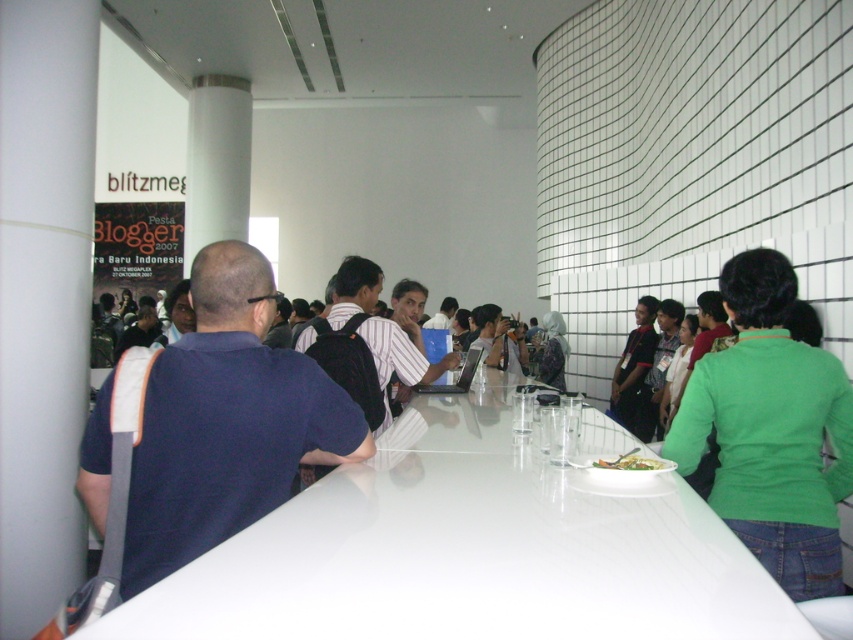
Question: Does dark blue shirt at left have a smaller size compared to green leafy salad at center?

Choices:
 (A) yes
 (B) no

Answer: (B)

Question: Among these points, which one is farthest from the camera?

Choices:
 (A) (328, 524)
 (B) (692, 460)
 (C) (187, 342)

Answer: (B)

Question: Which object appears farthest from the camera in this image?

Choices:
 (A) dark blue shirt at left
 (B) green leafy salad at center
 (C) white glossy table at center

Answer: (B)

Question: Is white glossy table at center smaller than dark blue shirt at left?

Choices:
 (A) no
 (B) yes

Answer: (B)

Question: Does dark blue shirt at left appear on the right side of dark blue shirt at center?

Choices:
 (A) no
 (B) yes

Answer: (A)

Question: Which of the following is the closest to the observer?

Choices:
 (A) green leafy salad at center
 (B) dark blue shirt at left
 (C) green matte shirt at center
 (D) white glossy table at center

Answer: (D)